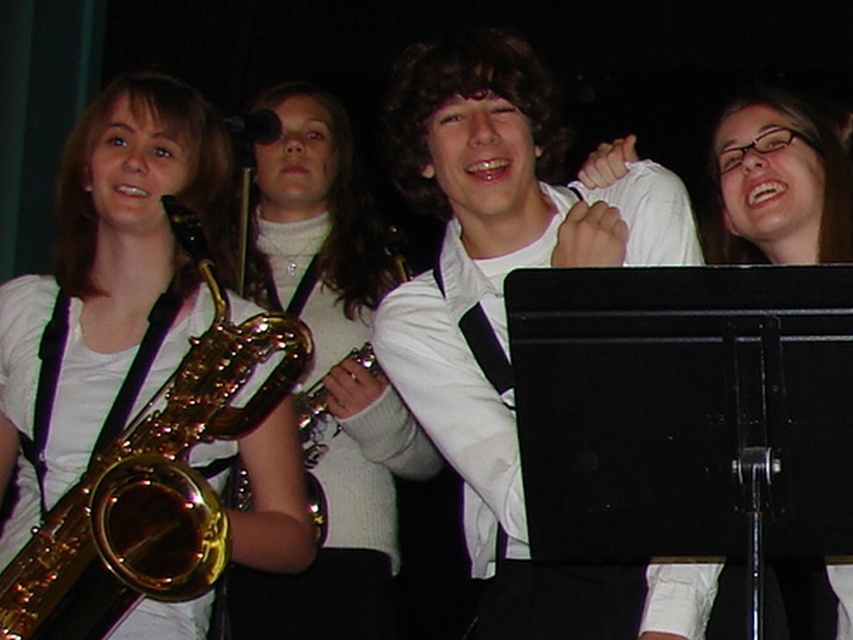
Question: Can you confirm if white matte shirt at center is wider than gold shiny saxophone at center?

Choices:
 (A) yes
 (B) no

Answer: (A)

Question: Which of the following is the closest to the observer?

Choices:
 (A) (677, 628)
 (B) (56, 417)
 (C) (335, 544)
 (D) (457, 406)

Answer: (A)

Question: Among these objects, which one is nearest to the camera?

Choices:
 (A) gold shiny saxophone at center
 (B) clear plastic glasses at upper center
 (C) gold shiny saxophone at left

Answer: (C)

Question: Can you confirm if gold shiny saxophone at center is smaller than clear plastic glasses at upper center?

Choices:
 (A) no
 (B) yes

Answer: (A)

Question: Which object is positioned closest to the gold shiny saxophone at left?

Choices:
 (A) gold shiny saxophone at center
 (B) white matte shirt at center

Answer: (B)

Question: Is gold shiny saxophone at center closer to the viewer compared to clear plastic glasses at upper center?

Choices:
 (A) no
 (B) yes

Answer: (A)